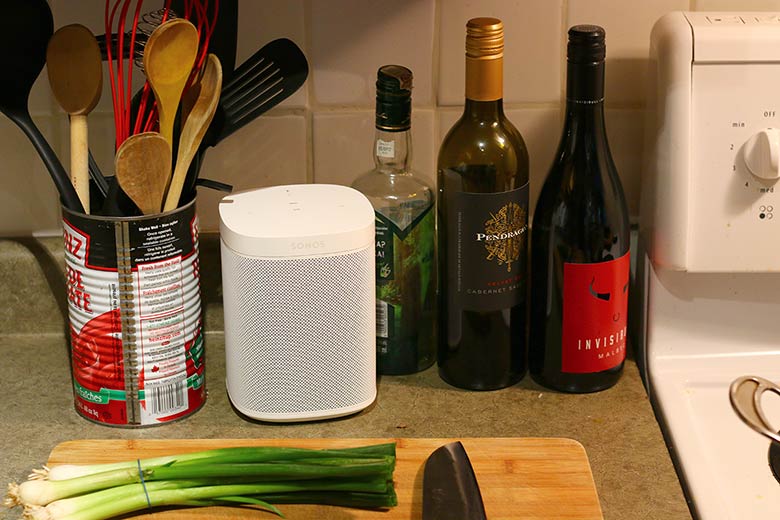
You are a GUI agent. You are given a task and a screenshot of the screen. Output one action in this format:
    pyautogui.click(x=<x>, y=<y>)
    Task: Click on the right side of cutting board
    The height and width of the screenshot is (520, 780).
    Given the screenshot: What is the action you would take?
    pyautogui.click(x=527, y=495)